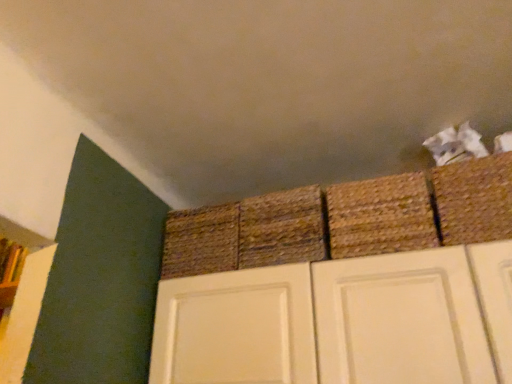
Question: In terms of size, does braided straw basket at upper right, the first basket in the right-to-left sequence, appear bigger or smaller than woven straw basket at center, arranged as the 1th basket when viewed from the left?

Choices:
 (A) small
 (B) big

Answer: (A)

Question: Choose the correct answer: Is braided straw basket at upper right, the first basket in the right-to-left sequence, inside woven straw basket at center, arranged as the 1th basket when viewed from the left, or outside it?

Choices:
 (A) outside
 (B) inside

Answer: (A)

Question: Which of these objects is positioned farthest from the braided straw basket at upper right, the first basket in the right-to-left sequence?

Choices:
 (A) wooden shelf at left
 (B) rustic woven basket at upper right, arranged as the third basket when viewed from the left
 (C) rustic woven basket at center, the third basket from the right
 (D) woven straw basket at center, arranged as the 4th basket when viewed from the right

Answer: (A)

Question: Estimate the real-world distances between objects in this image. Which object is farther from the rustic woven basket at center, the third basket from the right?

Choices:
 (A) braided straw basket at upper right, which is the fourth basket in left-to-right order
 (B) rustic woven basket at upper right, arranged as the third basket when viewed from the left
 (C) woven straw basket at center, arranged as the 4th basket when viewed from the right
 (D) wooden shelf at left

Answer: (D)